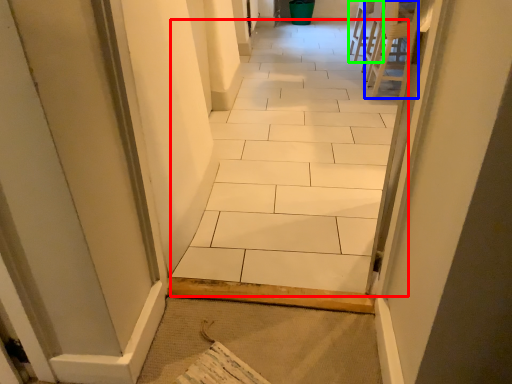
Question: Which is farther away from ceramic tile (highlighted by a red box)? chair (highlighted by a blue box) or chair (highlighted by a green box)?

Choices:
 (A) chair
 (B) chair

Answer: (B)